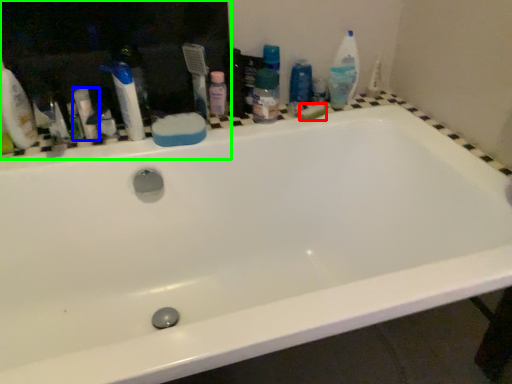
Question: Which object is positioned closest to soap (highlighted by a red box)? Select from toiletry (highlighted by a blue box) and medicine cabinet (highlighted by a green box).

Choices:
 (A) toiletry
 (B) medicine cabinet

Answer: (B)